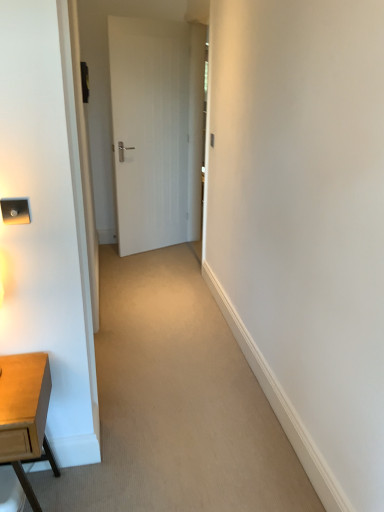
You are a GUI agent. You are given a task and a screenshot of the screen. Output one action in this format:
    pyautogui.click(x=<x>, y=<y>)
    Task: Click on the free space on the front side of white wood door at center
    
    Given the screenshot: What is the action you would take?
    pyautogui.click(x=157, y=265)